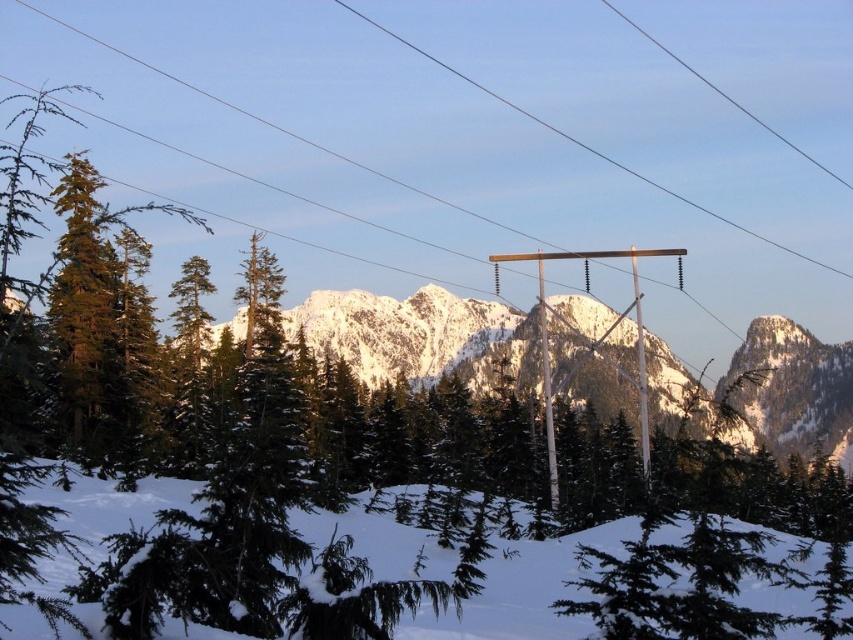
You are an engineer assessing the stability of the wooden pole at center in the winter scene. Considering the snowy granite mountain range at center is larger, how might the size difference affect the pole?

The snowy granite mountain range at center being larger than the wooden pole at center indicates the mountain range is closer to the viewer, which could mean the pole is farther away and less affected by the mountain range directly. However, the pole may still experience increased snow load from the surrounding environment, impacting its stability.

In the scene shown: You are standing in the winter landscape and want to take a photo of the snowy granite mountain range at center and the snowy pine trees at lower center. Which object should you focus on first to ensure both are in the frame?

You should focus on the snowy pine trees at lower center first because they are closer to you than the snowy granite mountain range at center, ensuring both are in the frame.

You are standing at the point marked as point (521, 592) in the image. Looking around, you see snowy pine trees at lower center. What do you see directly in front of you?

You see snowy pine trees at lower center directly in front of you at point (521, 592).